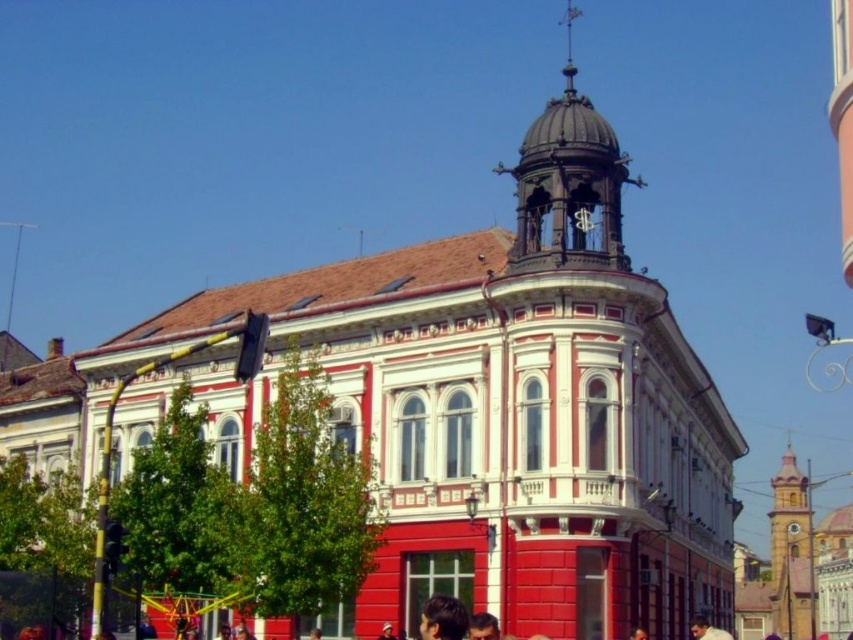
Does polished brass bell tower at upper center have a lesser height compared to brick clock tower at right?

Incorrect, polished brass bell tower at upper center's height does not fall short of brick clock tower at right's.

Which of these two, polished brass bell tower at upper center or brick clock tower at right, stands taller?

polished brass bell tower at upper center is taller.

Which is in front, point (575, 212) or point (798, 547)?

Point (575, 212) is more forward.

Locate an element on the screen. The height and width of the screenshot is (640, 853). polished brass bell tower at upper center is located at coordinates (567, 182).

Between brick clock tower at right and dark brown hair at lower center, which one appears on the right side from the viewer's perspective?

brick clock tower at right

Between brick clock tower at right and dark brown hair at lower center, which one is positioned lower?

brick clock tower at right is below.

Does point (790, 481) lie in front of point (450, 604)?

No, it is behind (450, 604).

At what (x,y) coordinates should I click in order to perform the action: click on brick clock tower at right. Please return your answer as a coordinate pair (x, y). Image resolution: width=853 pixels, height=640 pixels. Looking at the image, I should click on (788, 515).

Does polished brass bell tower at upper center have a greater width compared to dark brown hair at lower center?

Yes.

Which is above, polished brass bell tower at upper center or dark brown hair at lower center?

polished brass bell tower at upper center

Consider the image. Measure the distance between polished brass bell tower at upper center and camera.

polished brass bell tower at upper center and camera are 52.87 meters apart from each other.

Find the location of a particular element. This screenshot has height=640, width=853. polished brass bell tower at upper center is located at coordinates (567, 182).